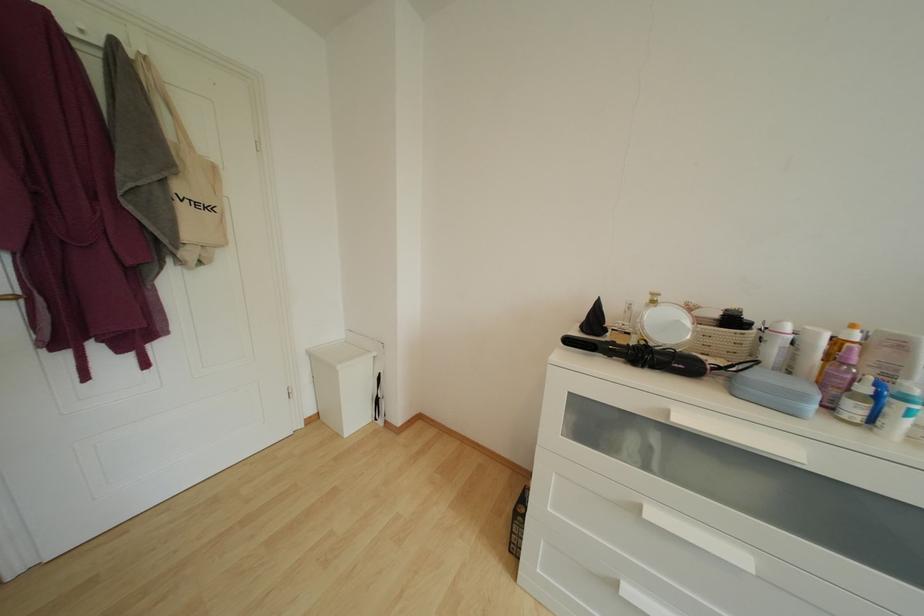
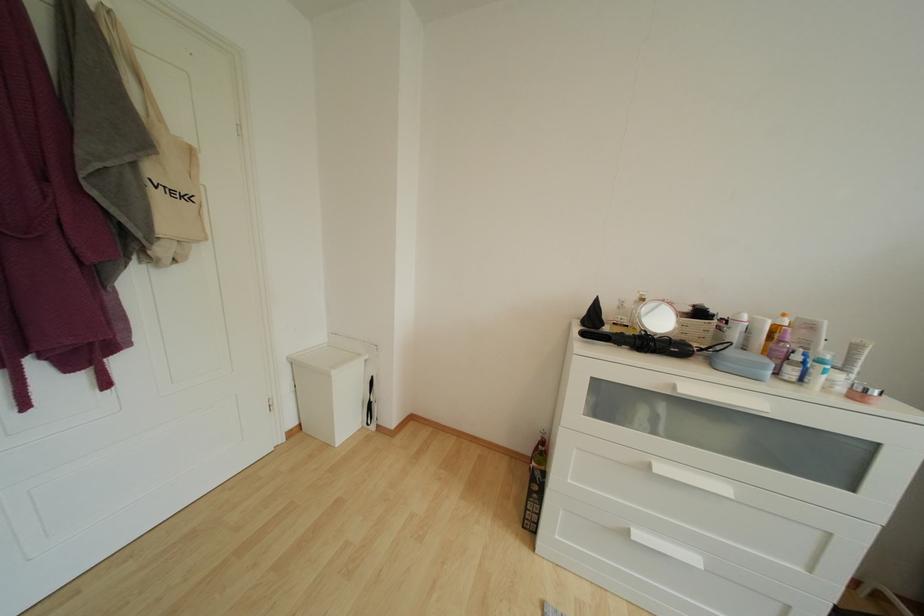
In the second image, find the point that corresponds to point 806,400 in the first image.

(767, 370)